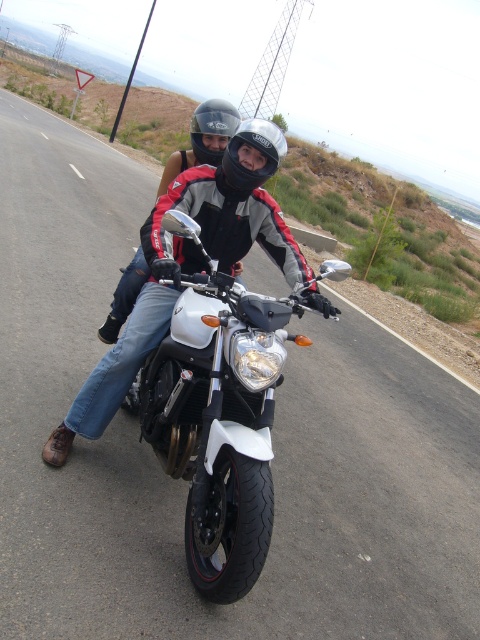
You are a delivery person who needs to secure a package on the white matte motorcycle at center. The package must be placed within 3 feet of the black matte helmet at center to ensure visibility. Can you place the package in the correct position?

The white matte motorcycle at center and black matte helmet at center are 3.60 feet apart from each other. Since the required distance is within 3 feet, the package cannot be placed in the correct position as it exceeds the allowed distance.

You are a delivery person who needs to carry a large package that is 2 meters wide. You see the matte black motorcycle at center and the black matte helmet at center. Can you place the package between them?

The matte black motorcycle at center might be wider than black matte helmet at center, so the package might not fit between them since the motorcycle could be wider than the helmet.

You are a photographer positioned on the side of the road. You want to capture a photo of the matte black motorcycle at center and the glossy black helmet at center. Which object should you focus on first to ensure both are in sharp focus?

The matte black motorcycle at center is in front of the glossy black helmet at center, so you should focus on the matte black motorcycle at center first to ensure both are in sharp focus.